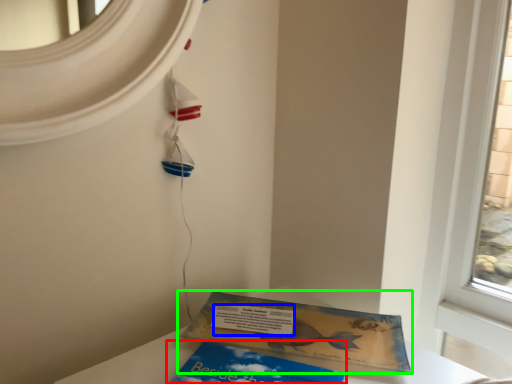
Question: Considering the real-world distances, which object is farthest from book (highlighted by a red box)? writing (highlighted by a blue box) or book (highlighted by a green box)?

Choices:
 (A) writing
 (B) book

Answer: (A)